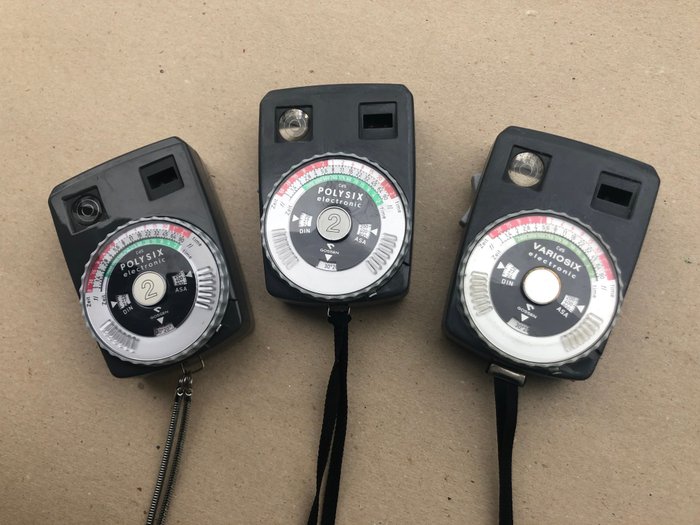
You are a GUI agent. You are given a task and a screenshot of the screen. Output one action in this format:
    pyautogui.click(x=<x>, y=<y>)
    Task: Click on the table
    
    Given the screenshot: What is the action you would take?
    tap(444, 423)